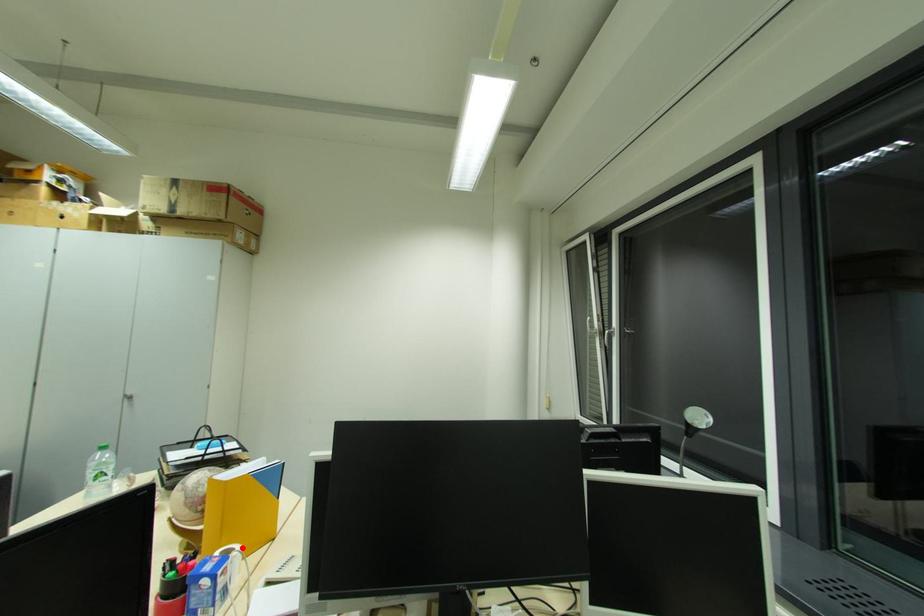
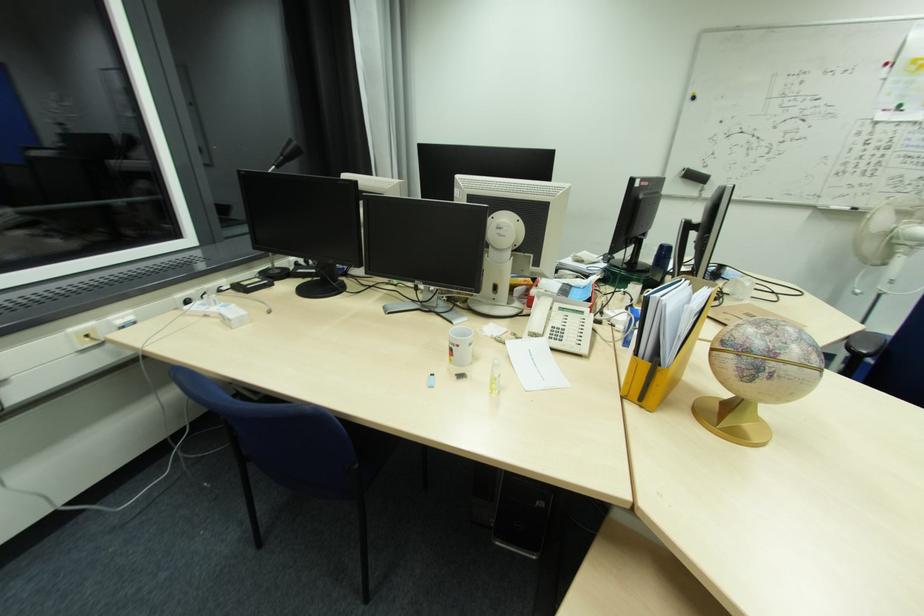
Question: I am providing you with two images of the same scene from different viewpoints. A red point is marked on the first image. Can you still see the location of the red point in image 2?

Choices:
 (A) Yes
 (B) No

Answer: (B)